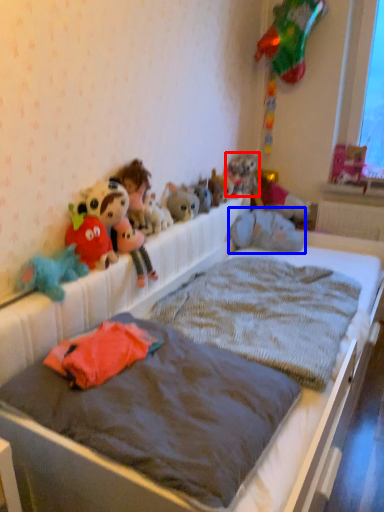
Question: Which of the following is the farthest to the observer, toy (highlighted by a red box) or toy (highlighted by a blue box)?

Choices:
 (A) toy
 (B) toy

Answer: (A)